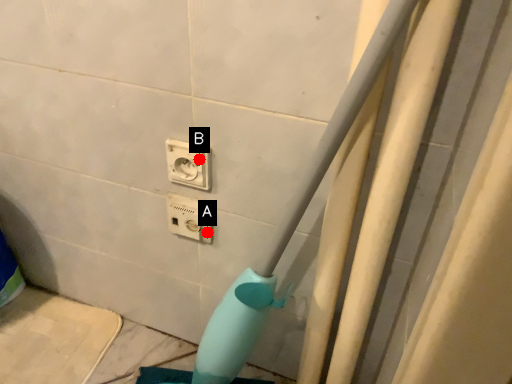
Question: Two points are circled on the image, labeled by A and B beside each circle. Among these points, which one is nearest to the camera?

Choices:
 (A) A is closer
 (B) B is closer

Answer: (B)